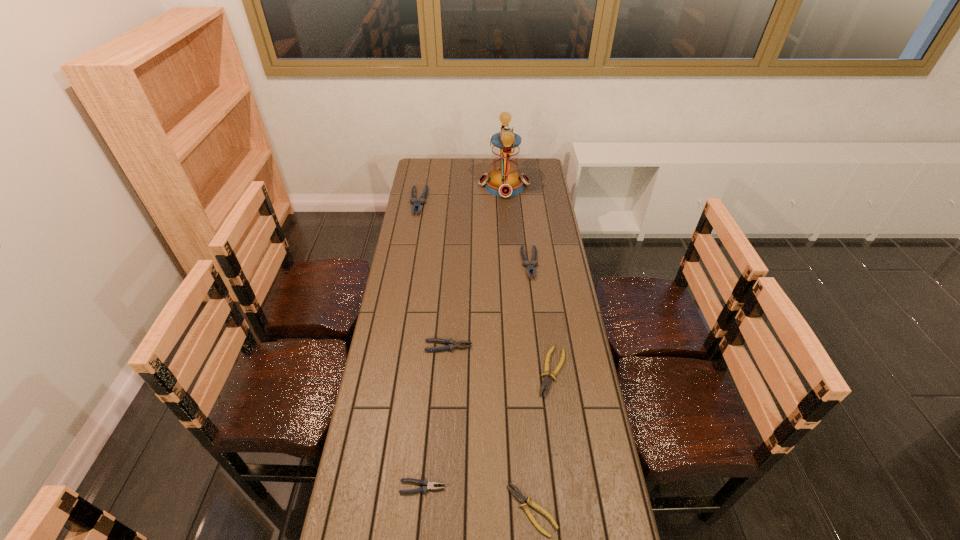
Find the location of a particular element. Image resolution: width=960 pixels, height=540 pixels. object that is at the far edge is located at coordinates (504, 180).

Image resolution: width=960 pixels, height=540 pixels. I want to click on lantern positioned at the right edge, so click(504, 180).

At what (x,y) coordinates should I click in order to perform the action: click on object present at the far right corner. Please return your answer as a coordinate pair (x, y). Looking at the image, I should click on (504, 180).

The width and height of the screenshot is (960, 540). Identify the location of vacant area at the far edge. (485, 166).

In the image, there is a desktop. What are the coordinates of `vacant space at the left edge` in the screenshot? It's located at (415, 227).

Identify the location of free space at the right edge. (564, 320).

In the image, there is a desktop. Where is `vacant region at the far left corner`? vacant region at the far left corner is located at coordinates (432, 165).

Locate an element on the screen. The image size is (960, 540). free space at the far right corner of the desktop is located at coordinates (536, 159).

I want to click on free space between the fourth shortest pliers and the lantern, so click(x=476, y=266).

Find the location of a particular element. This screenshot has height=540, width=960. free space that is in between the nearer yellow pliers and the lantern is located at coordinates (518, 348).